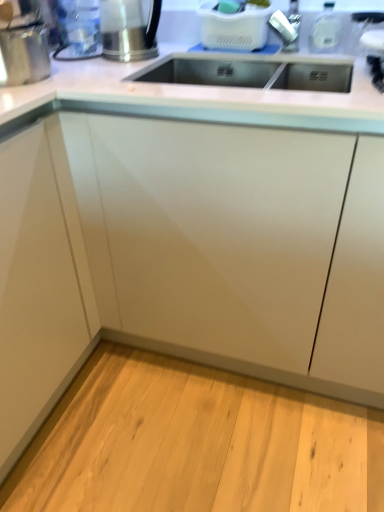
Question: In the image, is white glossy cabinet at center positioned in front of or behind brushed metal kettle at upper left, which is counted as the second appliance, starting from the right?

Choices:
 (A) front
 (B) behind

Answer: (A)

Question: Considering the positions of white glossy cabinet at center and brushed metal kettle at upper left, marked as the 3th appliance in a left-to-right arrangement, in the image, is white glossy cabinet at center taller or shorter than brushed metal kettle at upper left, marked as the 3th appliance in a left-to-right arrangement,?

Choices:
 (A) short
 (B) tall

Answer: (B)

Question: Which is nearer to the shiny metallic kettle at upper left, the 4th appliance viewed from the right?

Choices:
 (A) clear plastic water bottle at upper left, which ranks as the third appliance in right-to-left order
 (B) white plastic basket at upper center, the first appliance viewed from the right
 (C) brushed metal kettle at upper left, marked as the 3th appliance in a left-to-right arrangement
 (D) white glossy cabinet at center

Answer: (C)

Question: Which is nearer to the white plastic basket at upper center, acting as the 4th appliance starting from the left?

Choices:
 (A) shiny metallic kettle at upper left, which appears as the 1th appliance when viewed from the left
 (B) clear plastic water bottle at upper left, which ranks as the third appliance in right-to-left order
 (C) brushed metal kettle at upper left, marked as the 3th appliance in a left-to-right arrangement
 (D) white glossy cabinet at center

Answer: (C)